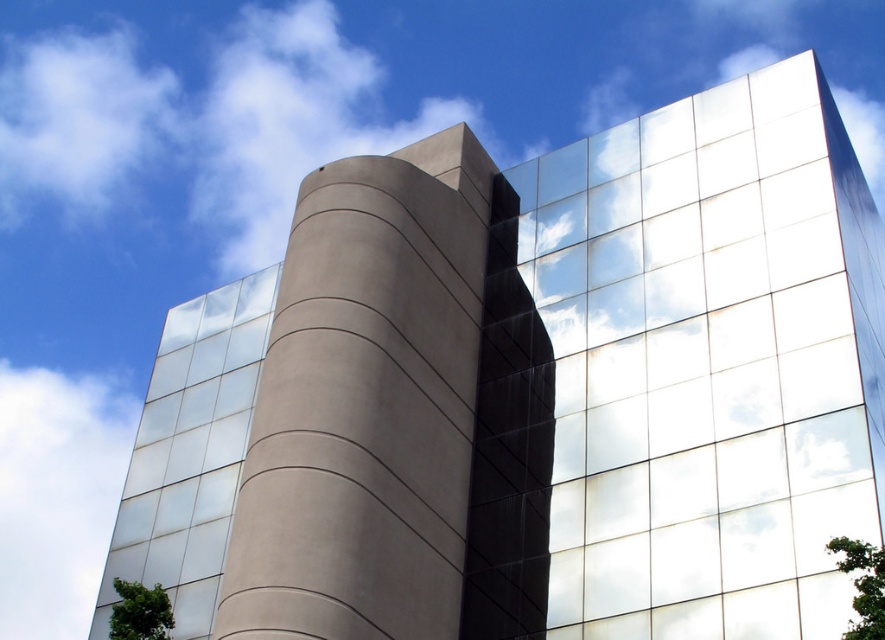
Consider the image. You are standing at point (190, 452) in the image. What object is located at this point?

The point (190, 452) is where the satin glass windows at left are located.